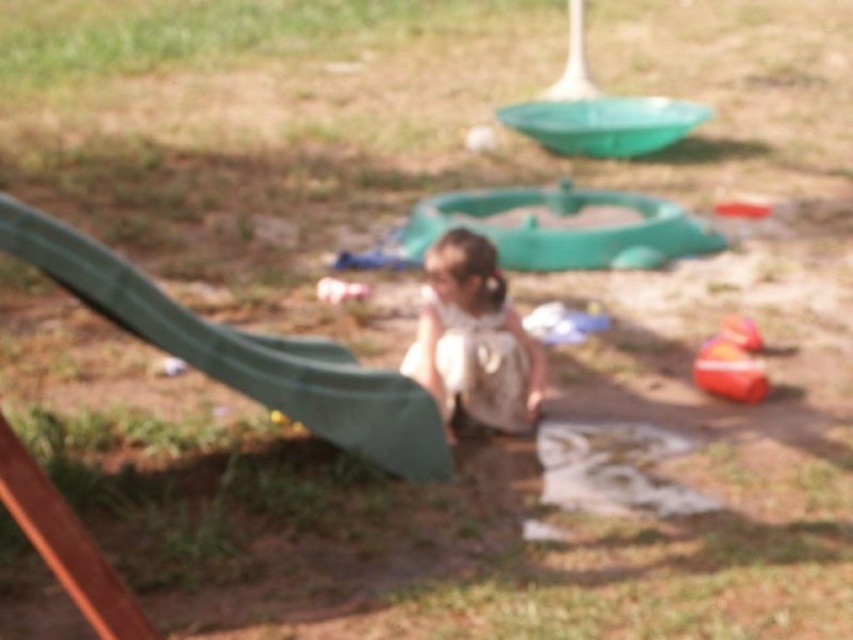
You are a parent trying to ensure your child plays safely. You see the green matte slide at left and the orange rubber boat at lower right. Which object is located higher up in the image?

The green matte slide at left is positioned over the orange rubber boat at lower right, meaning it is higher up in the image.

You are a parent at the playground. You see the green matte slide at left and the white fabric toddler at center. Which object is bigger?

The green matte slide at left is larger in size compared to the white fabric toddler at center.

From the picture: You are a parent trying to locate your child who is playing near the green matte slide at left and the orange rubber boat at lower right. Based on the scene description, which object is closer to you, the parent, as you look at the playground?

The green matte slide at left is closer to you because it is in front of the orange rubber boat at lower right, meaning the slide is nearer in the line of sight.